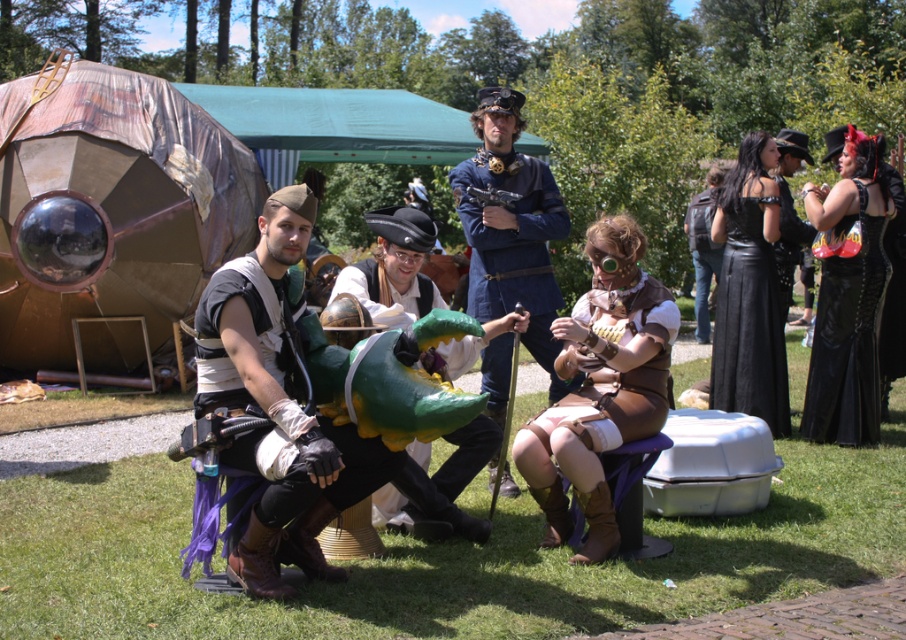
Question: Which of the following is the farthest from the observer?

Choices:
 (A) (820, 259)
 (B) (379, 515)
 (C) (690, 232)
 (D) (783, 214)

Answer: (C)

Question: Which object appears farthest from the camera in this image?

Choices:
 (A) black leather jacket at upper right
 (B) blue fabric coat at center
 (C) black leather dress at right

Answer: (A)

Question: Is black leather dress at right below black leather vest at center?

Choices:
 (A) yes
 (B) no

Answer: (A)

Question: Is blue fabric coat at center bigger than black leather dress at right?

Choices:
 (A) no
 (B) yes

Answer: (B)

Question: Is brown leather vest at center above blue fabric coat at center?

Choices:
 (A) yes
 (B) no

Answer: (B)

Question: Which point appears closest to the camera in this image?

Choices:
 (A) (458, 368)
 (B) (550, 204)
 (C) (865, 410)
 (D) (533, 493)

Answer: (D)